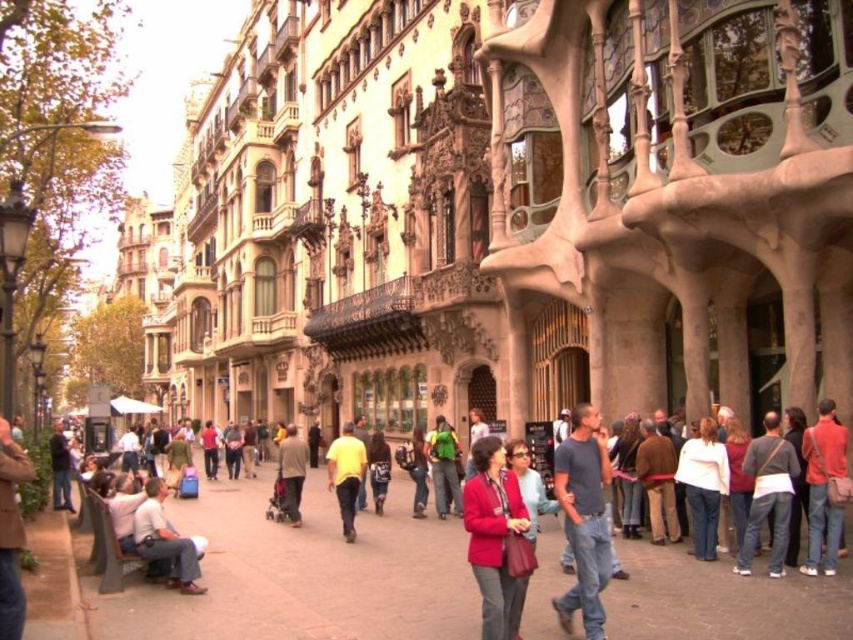
Is dark blue t-shirt at center bigger than yellow matte shirt at center?

No.

Who is positioned more to the right, dark blue t-shirt at center or yellow matte shirt at center?

dark blue t-shirt at center

Which is in front, point (595, 500) or point (344, 449)?

Point (595, 500) is more forward.

In order to click on dark blue t-shirt at center in this screenshot , I will do pyautogui.click(x=583, y=518).

Which is in front, point (474, 445) or point (454, 499)?

Point (474, 445)

Does point (482, 557) come in front of point (450, 458)?

Yes, point (482, 557) is closer to viewer.

Is point (474, 561) closer to viewer compared to point (450, 460)?

Yes.

Where is `matte red jacket at center`? The width and height of the screenshot is (853, 640). matte red jacket at center is located at coordinates (492, 532).

Does point (566, 529) come in front of point (68, 509)?

Yes, point (566, 529) is closer to viewer.

Between point (561, 600) and point (59, 458), which one is positioned in front?

Point (561, 600) is more forward.

The image size is (853, 640). What are the coordinates of `dark blue t-shirt at center` in the screenshot? It's located at (583, 518).